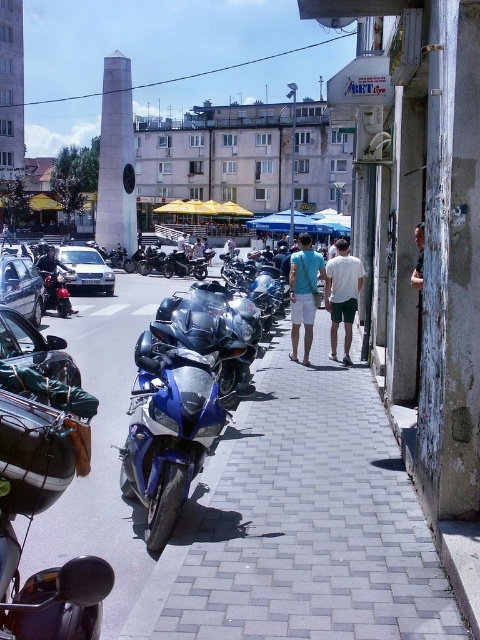
Question: Can you confirm if glossy metallic motorcycle at center is smaller than matte blue motorcycle at center?

Choices:
 (A) no
 (B) yes

Answer: (A)

Question: Which point is farther to the camera?

Choices:
 (A) shiny chrome motorcycle at left
 (B) white cotton shirt at center

Answer: (A)

Question: Which object is the closest to the shiny blue motorcycle at center?

Choices:
 (A) glossy metallic motorcycle at center
 (B) matte blue motorcycle at center

Answer: (B)

Question: Is white cotton shirt at center below shiny chrome motorcycle at left?

Choices:
 (A) no
 (B) yes

Answer: (B)

Question: Which of the following is the closest to the observer?

Choices:
 (A) shiny blue motorcycle at center
 (B) matte blue motorcycle at center
 (C) glossy metallic motorcycle at center
 (D) white cotton shirt at center

Answer: (C)

Question: Is glossy metallic motorcycle at center positioned in front of white cotton shirt at center?

Choices:
 (A) yes
 (B) no

Answer: (A)